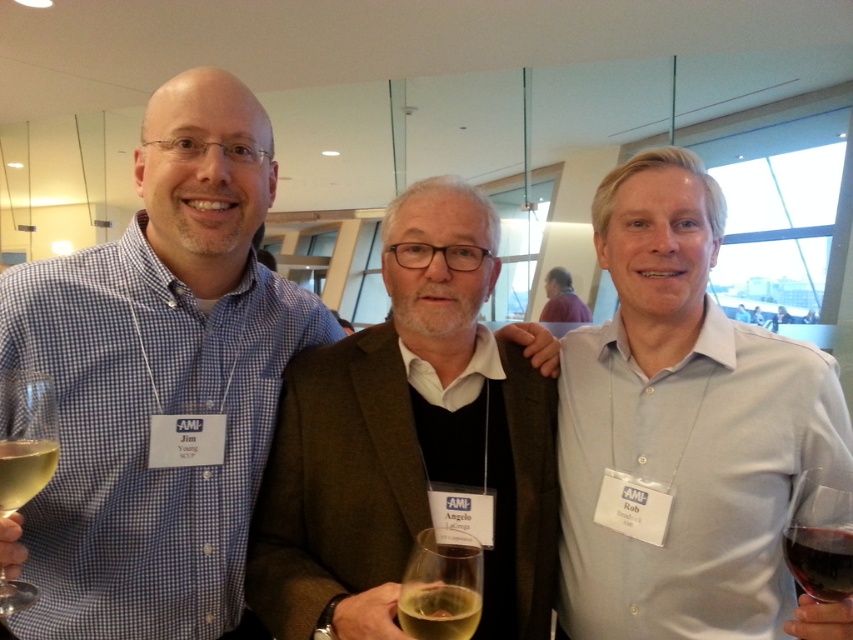
Can you confirm if blue checkered shirt at left is positioned to the right of dark purple sweater at center?

In fact, blue checkered shirt at left is to the left of dark purple sweater at center.

Which is in front, point (57, 545) or point (572, 296)?

Positioned in front is point (57, 545).

At what (x,y) coordinates should I click in order to perform the action: click on blue checkered shirt at left. Please return your answer as a coordinate pair (x, y). Image resolution: width=853 pixels, height=640 pixels. Looking at the image, I should click on pyautogui.click(x=160, y=381).

Does translucent glass wine at right have a lesser width compared to translucent glass at center?

Yes.

Which is above, translucent glass wine at right or translucent glass at center?

translucent glass wine at right is higher up.

Does point (822, 573) lie in front of point (444, 602)?

Yes, it is in front of point (444, 602).

The height and width of the screenshot is (640, 853). In order to click on translucent glass wine at right in this screenshot , I will do `click(819, 540)`.

Is red glass wine at lower right to the left of dark purple sweater at center from the viewer's perspective?

Indeed, red glass wine at lower right is positioned on the left side of dark purple sweater at center.

Which is behind, point (830, 529) or point (577, 300)?

The point (577, 300) is behind.

Where is `red glass wine at lower right`? red glass wine at lower right is located at coordinates (819, 561).